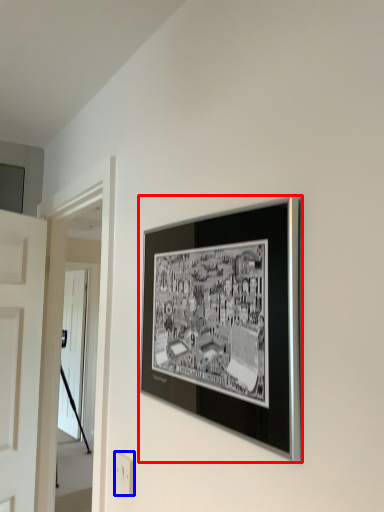
Question: Which of the following is the closest to the observer, picture frame (highlighted by a red box) or electric outlet (highlighted by a blue box)?

Choices:
 (A) picture frame
 (B) electric outlet

Answer: (A)